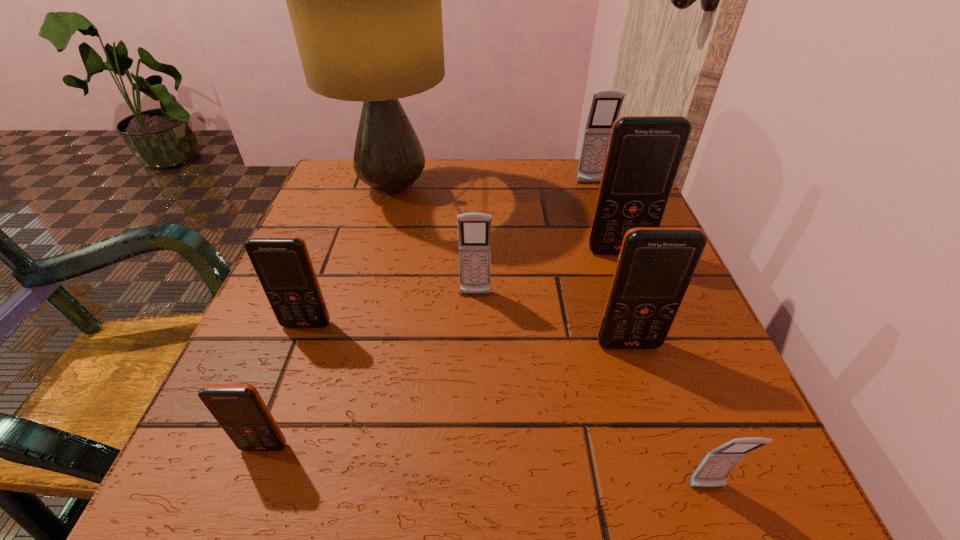
Where is `the tallest object`? The height and width of the screenshot is (540, 960). the tallest object is located at coordinates (364, 0).

This screenshot has height=540, width=960. What are the coordinates of `lampshade` in the screenshot? It's located at (364, 0).

The height and width of the screenshot is (540, 960). Identify the location of the biggest orange cellular telephone. (644, 153).

This screenshot has height=540, width=960. Find the location of `the seventh shortest object`. the seventh shortest object is located at coordinates (644, 153).

Locate an element on the screen. the farthest cellular telephone is located at coordinates (605, 107).

At what (x,y) coordinates should I click in order to perform the action: click on the biggest gray cellular telephone. Please return your answer as a coordinate pair (x, y). The height and width of the screenshot is (540, 960). Looking at the image, I should click on (605, 107).

Where is `the second biggest orange cellular telephone`? Image resolution: width=960 pixels, height=540 pixels. the second biggest orange cellular telephone is located at coordinates (655, 265).

The width and height of the screenshot is (960, 540). Find the location of `the third nearest object`. the third nearest object is located at coordinates (655, 265).

Where is `the fifth nearest cellular telephone`? The image size is (960, 540). the fifth nearest cellular telephone is located at coordinates (474, 229).

In order to click on the second biggest gray cellular telephone in this screenshot , I will do `click(474, 229)`.